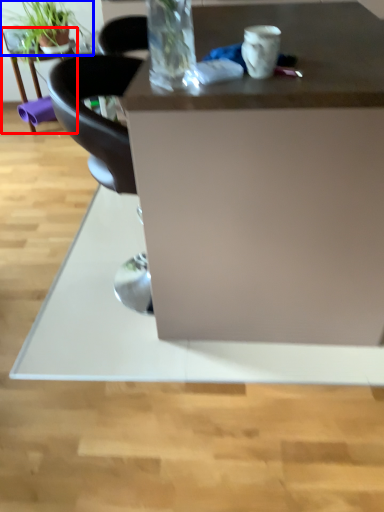
Question: Which point is further to the camera, table (highlighted by a red box) or houseplant (highlighted by a blue box)?

Choices:
 (A) table
 (B) houseplant

Answer: (A)